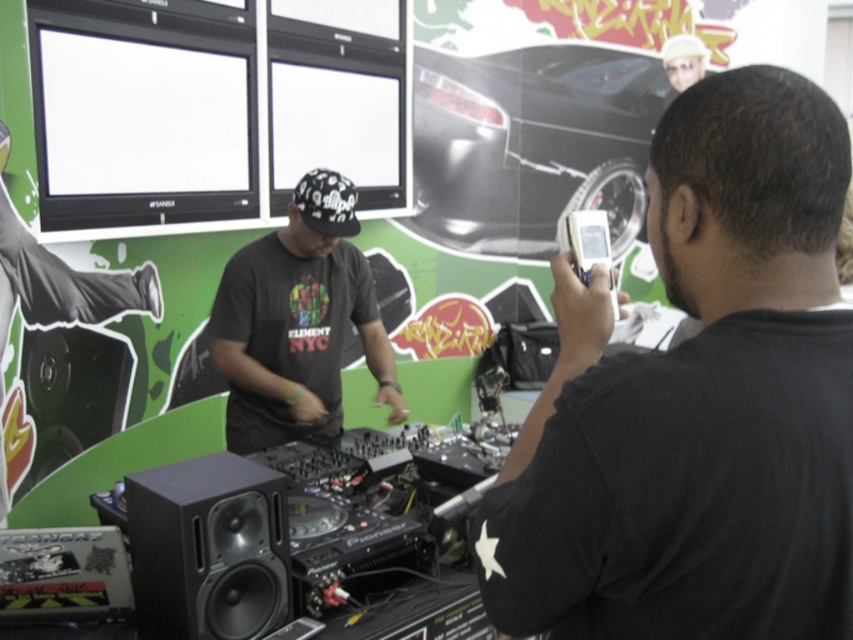
You are standing in front of the DJ setup. You need to reach both the point at (259, 442) and the point at (190, 637). Which point should you reach first if you want to touch them in order from closest to farthest?

You should reach the point at (190, 637) first because it is closer to you than the point at (259, 442), which is further away.

You are standing in front of the DJ setup and want to reach both points marked on the equipment. Which point, point (561, 612) or point (212, 564), is closer to you?

Point (561, 612) is closer to the viewer than point (212, 564).